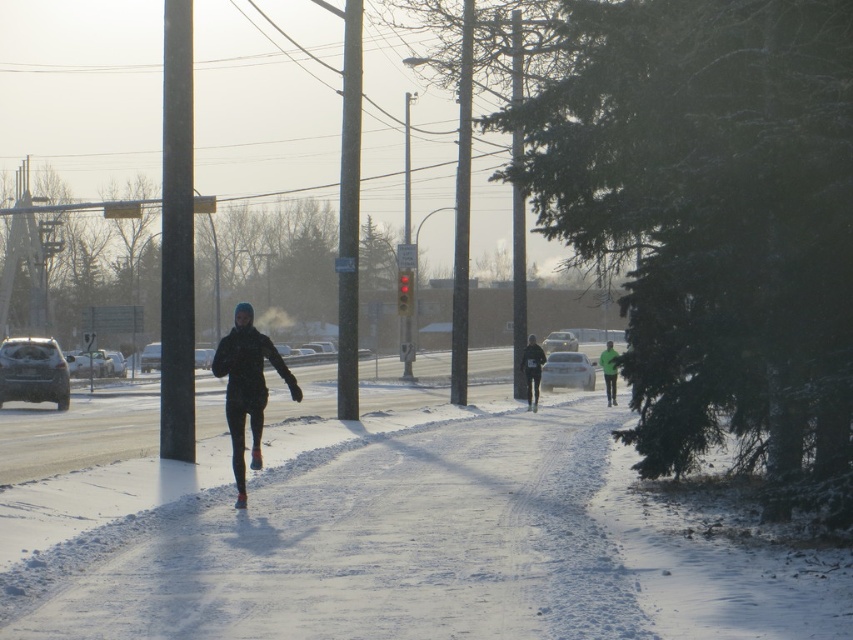
Which is above, black fabric jacket at center or green matte jacket at center?

Positioned higher is black fabric jacket at center.

Between point (534, 364) and point (608, 378), which one is positioned in front?

Point (534, 364)

At what (x,y) coordinates should I click in order to perform the action: click on black fabric jacket at center. Please return your answer as a coordinate pair (x, y). This screenshot has width=853, height=640. Looking at the image, I should click on (532, 371).

Does black matte jacket at center have a greater width compared to black fabric jacket at center?

Indeed, black matte jacket at center has a greater width compared to black fabric jacket at center.

Which is in front, point (241, 490) or point (529, 362)?

Point (241, 490)

Is point (234, 452) closer to camera compared to point (534, 376)?

Yes.

At what (x,y) coordinates should I click in order to perform the action: click on black matte jacket at center. Please return your answer as a coordinate pair (x, y). This screenshot has width=853, height=640. Looking at the image, I should click on (247, 387).

Locate an element on the screen. Image resolution: width=853 pixels, height=640 pixels. black matte jacket at center is located at coordinates (247, 387).

Can you confirm if black matte jacket at center is wider than green matte jacket at center?

No.

Describe the element at coordinates (247, 387) in the screenshot. The width and height of the screenshot is (853, 640). I see `black matte jacket at center` at that location.

Identify the location of black matte jacket at center. (247, 387).